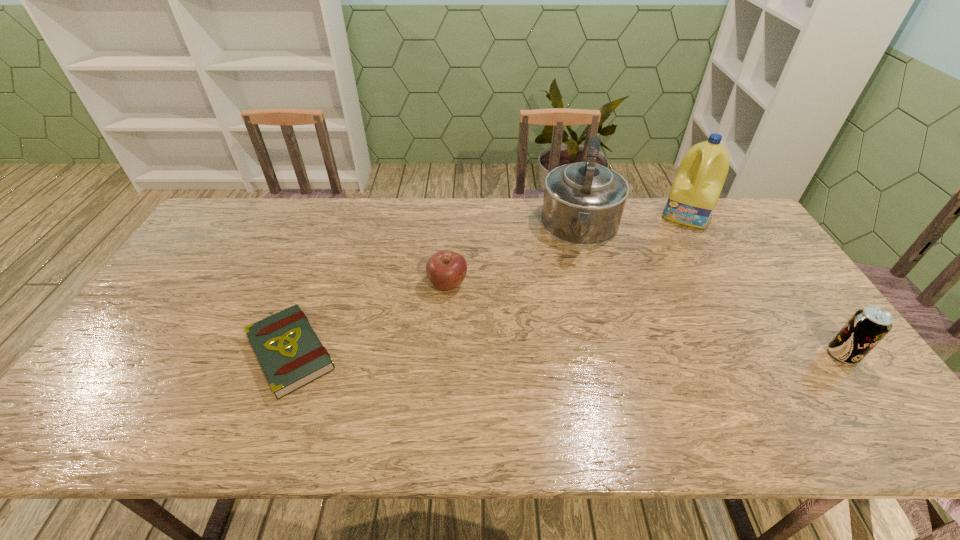
At what (x,y) coordinates should I click in order to perform the action: click on vacant space located 0.100m on the side of the second shortest object with the unique marking. Please return your answer as a coordinate pair (x, y). Looking at the image, I should click on (477, 318).

The width and height of the screenshot is (960, 540). What are the coordinates of `free space located on the side of the second shortest object with the unique marking` in the screenshot? It's located at (501, 345).

Where is `vacant space located on the side of the second shortest object with the unique marking`? This screenshot has width=960, height=540. vacant space located on the side of the second shortest object with the unique marking is located at coordinates (549, 399).

I want to click on vacant region located with the spout at the front of the third object from left to right, so click(580, 275).

Identify the location of vacant space located 0.220m with the spout at the front of the third object from left to right. The image size is (960, 540). (575, 314).

Locate an element on the screen. vacant space located 0.370m with the spout at the front of the third object from left to right is located at coordinates (571, 358).

You are a GUI agent. You are given a task and a screenshot of the screen. Output one action in this format:
    pyautogui.click(x=<x>, y=<y>)
    Task: Click on the free space located on the label of the detergent
    This screenshot has width=960, height=540.
    Given the screenshot: What is the action you would take?
    pyautogui.click(x=657, y=300)

The image size is (960, 540). In order to click on free point located on the label of the detergent in this screenshot , I will do `click(661, 287)`.

Locate an element on the screen. Image resolution: width=960 pixels, height=540 pixels. vacant region located 0.100m on the label of the detergent is located at coordinates (676, 245).

Image resolution: width=960 pixels, height=540 pixels. Find the location of `kettle located at the far edge`. kettle located at the far edge is located at coordinates (583, 203).